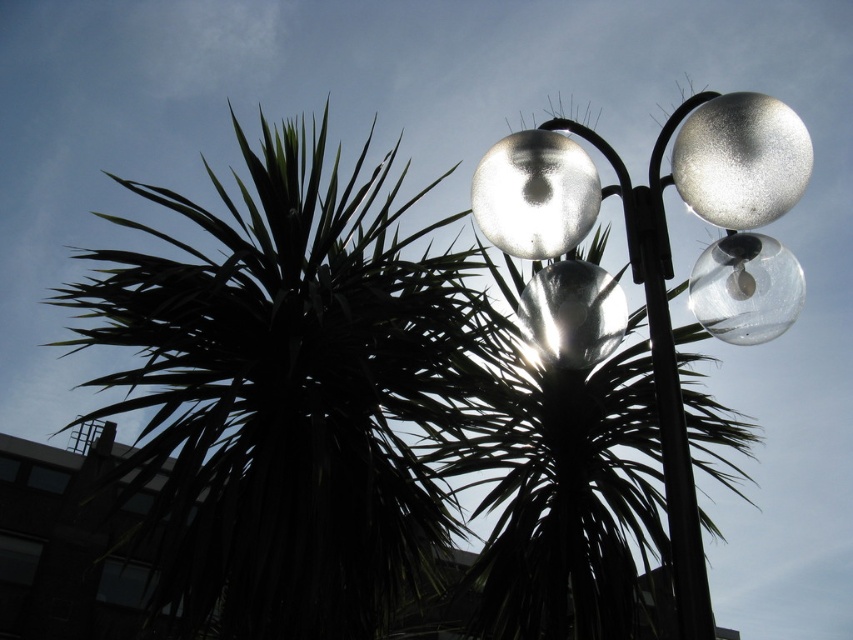
You are a window cleaner standing at the point marked as point [535,195]. You need to clean the glossy glass light at upper center located at that point. What object is at your current position?

The glossy glass light at upper center is located at point [535,195].

You are designing a garden layout and need to place both the metallic silver sphere at upper right and the transparent glass globe at right. Given their sizes, which one should you place in a more prominent position to ensure visibility?

The metallic silver sphere at upper right should be placed in a more prominent position since it is larger than the transparent glass globe at right, making it more noticeable.

You are standing in front of the streetlamp and notice the green leafy palm tree at left and the satin silver globes at upper right. Which object is positioned higher in the image?

The satin silver globes at upper right are positioned higher than the green leafy palm tree at left.